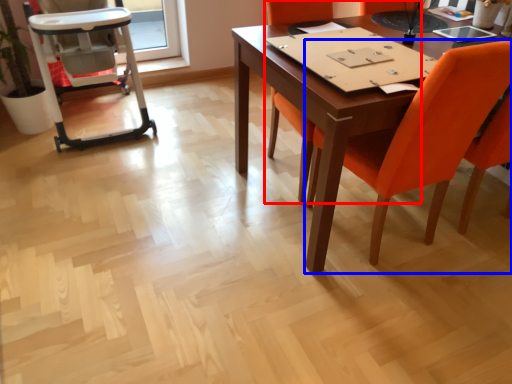
Question: Which object appears farthest to the camera in this image, chair (highlighted by a red box) or chair (highlighted by a blue box)?

Choices:
 (A) chair
 (B) chair

Answer: (A)